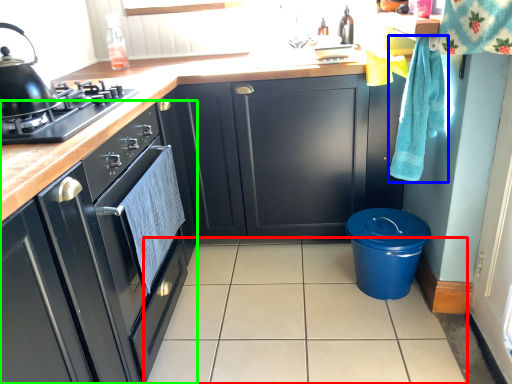
Question: Which object is the farthest from tile (highlighted by a red box)? Choose among these: hand towel (highlighted by a blue box) or cabinetry (highlighted by a green box).

Choices:
 (A) hand towel
 (B) cabinetry

Answer: (A)